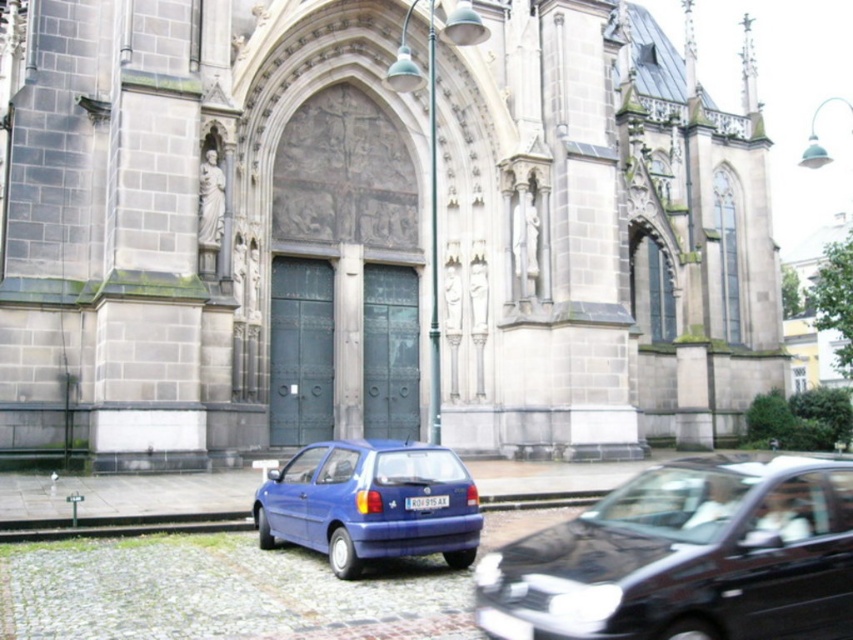
Consider the image. Between gray stone church at center and blue matte hatchback at lower center, which one is positioned higher?

gray stone church at center is above.

Who is lower down, gray stone church at center or blue matte hatchback at lower center?

Positioned lower is blue matte hatchback at lower center.

Does point (200, 17) come in front of point (282, 506)?

No, it is behind (282, 506).

Image resolution: width=853 pixels, height=640 pixels. In order to click on gray stone church at center in this screenshot , I will do point(207,228).

How much distance is there between gray stone church at center and white plastic license plate at center?

gray stone church at center and white plastic license plate at center are 155.98 feet apart.

You are a GUI agent. You are given a task and a screenshot of the screen. Output one action in this format:
    pyautogui.click(x=<x>, y=<y>)
    Task: Click on the gray stone church at center
    
    Given the screenshot: What is the action you would take?
    pyautogui.click(x=207, y=228)

The image size is (853, 640). What are the coordinates of `gray stone church at center` in the screenshot? It's located at (207, 228).

Which of these two, matte blue hatchback at lower left or white plastic license plate at center, stands shorter?

white plastic license plate at center

I want to click on matte blue hatchback at lower left, so click(686, 556).

The height and width of the screenshot is (640, 853). I want to click on matte blue hatchback at lower left, so click(686, 556).